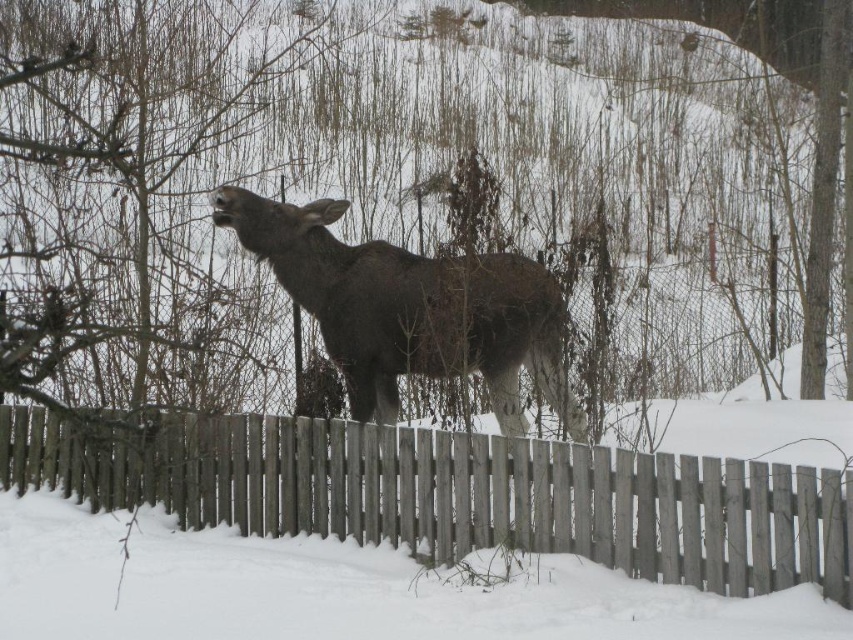
Question: Can you confirm if wooden picket fence at center is wider than dark brown fur at center?

Choices:
 (A) yes
 (B) no

Answer: (A)

Question: Which point is farther to the camera?

Choices:
 (A) (88, 477)
 (B) (347, 381)

Answer: (B)

Question: Which point is closer to the camera?

Choices:
 (A) dark brown fur at center
 (B) wooden picket fence at center

Answer: (B)

Question: Does wooden picket fence at center appear on the right side of dark brown fur at center?

Choices:
 (A) no
 (B) yes

Answer: (A)

Question: Among these objects, which one is farthest from the camera?

Choices:
 (A) dark brown fur at center
 (B) wooden picket fence at center

Answer: (A)

Question: Is wooden picket fence at center to the left of dark brown fur at center from the viewer's perspective?

Choices:
 (A) yes
 (B) no

Answer: (A)